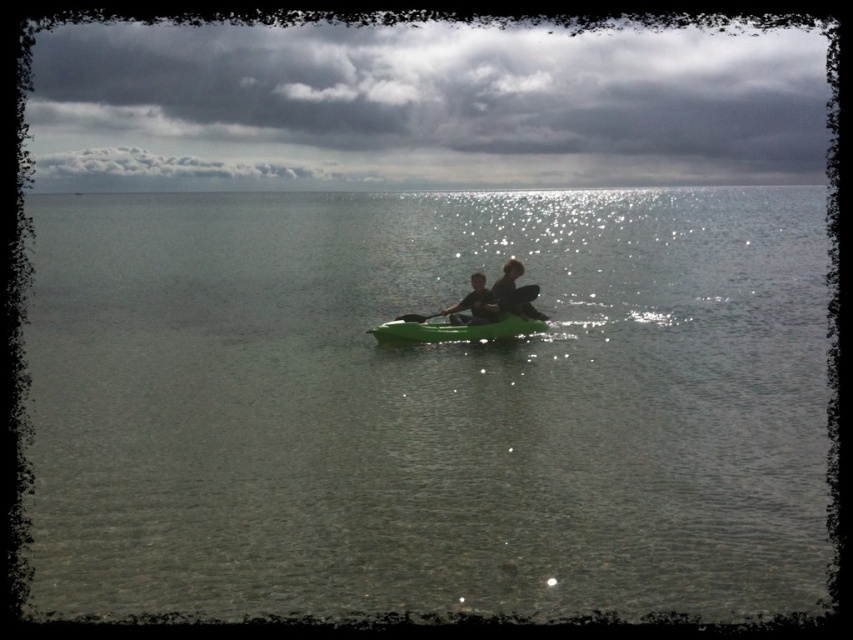
Question: Considering the real-world distances, which object is farthest from the green plastic paddle at center?

Choices:
 (A) smooth black kayak at center
 (B) clear water at center
 (C) green plastic canoe at center
 (D) green plastic kayak at center

Answer: (B)

Question: Is green plastic canoe at center to the left of smooth black kayak at center from the viewer's perspective?

Choices:
 (A) no
 (B) yes

Answer: (B)

Question: Observing the image, what is the correct spatial positioning of green plastic canoe at center in reference to green plastic paddle at center?

Choices:
 (A) right
 (B) left

Answer: (A)

Question: Which of the following is the closest to the observer?

Choices:
 (A) green plastic kayak at center
 (B) green plastic paddle at center

Answer: (B)

Question: Estimate the real-world distances between objects in this image. Which object is farther from the green plastic canoe at center?

Choices:
 (A) matte green kayak at center
 (B) smooth black kayak at center
 (C) green plastic paddle at center
 (D) clear water at center

Answer: (D)

Question: Is clear water at center in front of green plastic paddle at center?

Choices:
 (A) yes
 (B) no

Answer: (A)